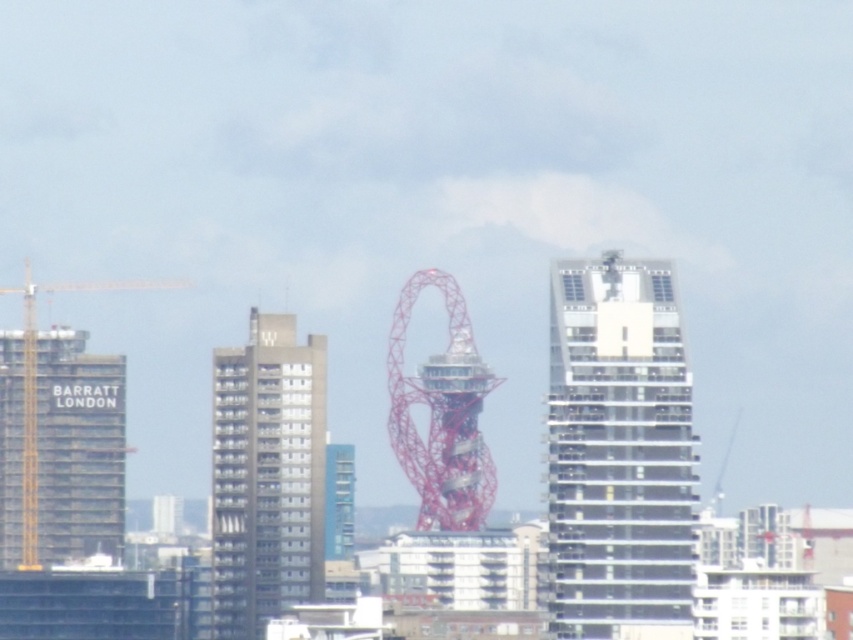
Who is shorter, white glass building at center or yellow metallic crane at left?

yellow metallic crane at left is shorter.

Describe the element at coordinates (618, 449) in the screenshot. I see `white glass building at center` at that location.

Is point (579, 340) farther from camera compared to point (129, 285)?

That is False.

Image resolution: width=853 pixels, height=640 pixels. Identify the location of white glass building at center. (618, 449).

This screenshot has width=853, height=640. Describe the element at coordinates (265, 476) in the screenshot. I see `gray concrete building at center` at that location.

Who is positioned more to the right, gray concrete building at center or yellow metallic crane at left?

gray concrete building at center is more to the right.

Find the location of `gray concrete building at center`. gray concrete building at center is located at coordinates (265, 476).

Does white glass building at center come behind gray concrete building at center?

Yes, white glass building at center is further from the viewer.

Who is more forward, (662, 404) or (213, 529)?

Point (662, 404)

Image resolution: width=853 pixels, height=640 pixels. In order to click on white glass building at center in this screenshot , I will do `click(618, 449)`.

Identify the location of white glass building at center. This screenshot has height=640, width=853. (618, 449).